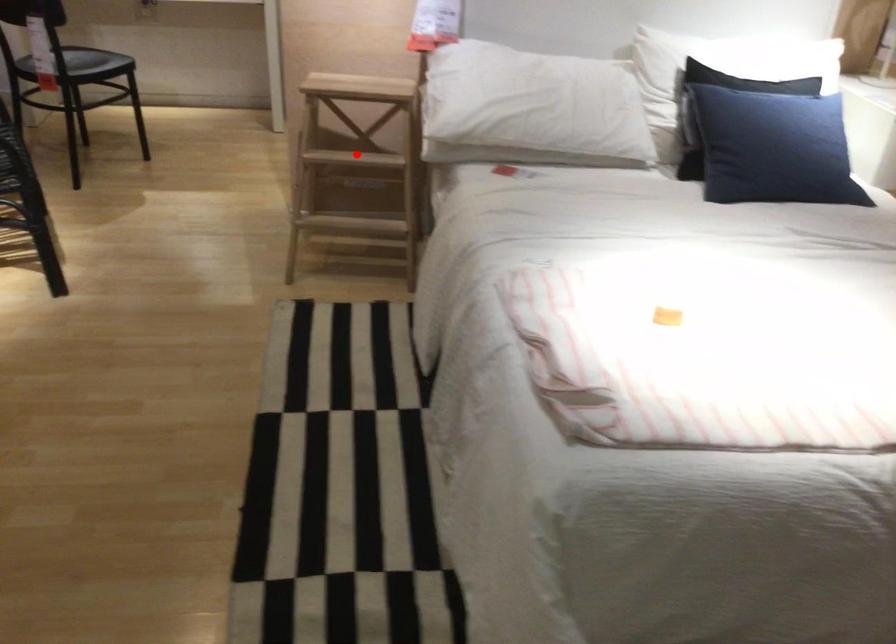
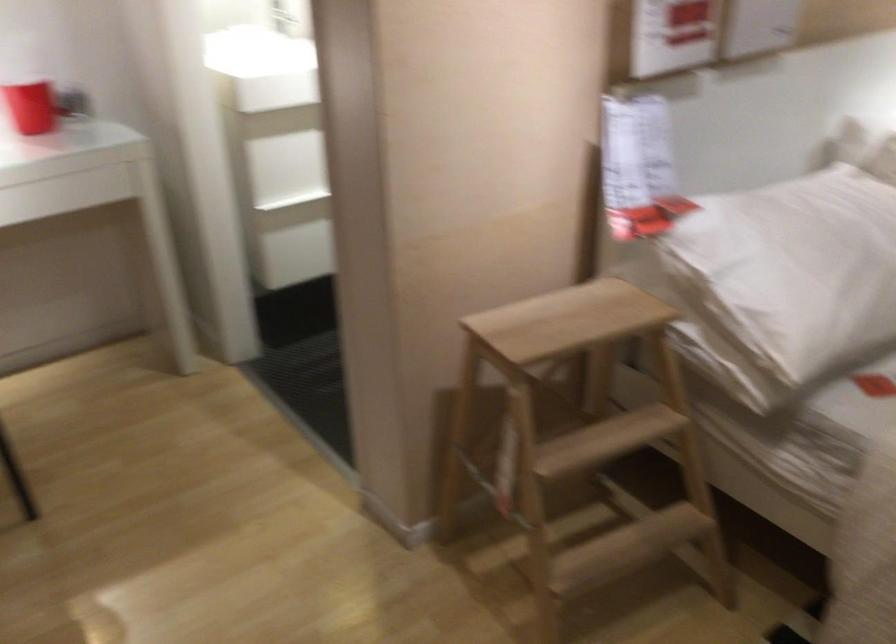
Question: A red point is marked in image1. In image2, is the corresponding 3D point closer to the camera or farther? Reply with the corresponding letter.

Choices:
 (A) The corresponding 3D point is closer.
 (B) The corresponding 3D point is farther.

Answer: (A)